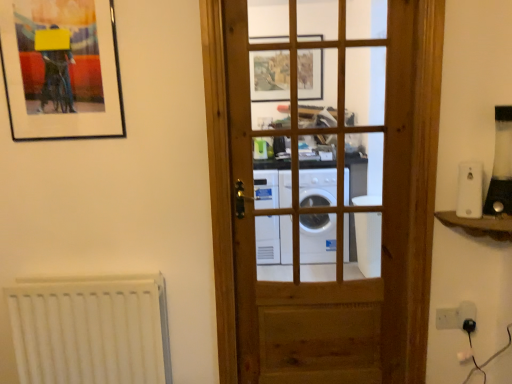
Question: Is white plastic light switch at lower right not close to white plastic electric outlet at lower right?

Choices:
 (A) no
 (B) yes

Answer: (A)

Question: Does white plastic light switch at lower right have a greater height compared to white plastic electric outlet at lower right?

Choices:
 (A) yes
 (B) no

Answer: (B)

Question: Considering the relative sizes of white plastic light switch at lower right and white plastic electric outlet at lower right in the image provided, is white plastic light switch at lower right bigger than white plastic electric outlet at lower right?

Choices:
 (A) yes
 (B) no

Answer: (B)

Question: From a real-world perspective, is white plastic light switch at lower right located higher than white plastic electric outlet at lower right?

Choices:
 (A) no
 (B) yes

Answer: (A)

Question: From a real-world perspective, is white plastic light switch at lower right beneath white plastic electric outlet at lower right?

Choices:
 (A) no
 (B) yes

Answer: (B)

Question: From the image's perspective, is white plastic light switch at right, which is the 1th appliance from left to right, located above or below white plastic electric outlet at lower right?

Choices:
 (A) below
 (B) above

Answer: (B)

Question: Is white plastic light switch at right, which is the 1th appliance from left to right, situated inside white plastic electric outlet at lower right or outside?

Choices:
 (A) outside
 (B) inside

Answer: (A)

Question: Is point (458, 188) positioned closer to the camera than point (457, 307)?

Choices:
 (A) closer
 (B) farther

Answer: (A)

Question: Considering their positions, is white plastic light switch at right, the second appliance from the right, located in front of or behind white plastic electric outlet at lower right?

Choices:
 (A) front
 (B) behind

Answer: (A)

Question: From a real-world perspective, is black plastic blender at right, marked as the 1th appliance in a right-to-left arrangement, physically located above or below white plastic electric outlet at lower right?

Choices:
 (A) above
 (B) below

Answer: (A)

Question: Choose the correct answer: Is black plastic blender at right, the second appliance from the left, inside white plastic electric outlet at lower right or outside it?

Choices:
 (A) inside
 (B) outside

Answer: (B)

Question: Does point (505, 208) appear closer or farther from the camera than point (468, 306)?

Choices:
 (A) closer
 (B) farther

Answer: (A)

Question: Based on their positions, is black plastic blender at right, marked as the 1th appliance in a right-to-left arrangement, located to the left or right of white plastic electric outlet at lower right?

Choices:
 (A) left
 (B) right

Answer: (B)

Question: Is white plastic light switch at lower right wider or thinner than white plastic light switch at right, the second appliance from the right?

Choices:
 (A) wide
 (B) thin

Answer: (B)

Question: Is white plastic light switch at lower right inside or outside of white plastic light switch at right, the second appliance from the right?

Choices:
 (A) outside
 (B) inside

Answer: (A)